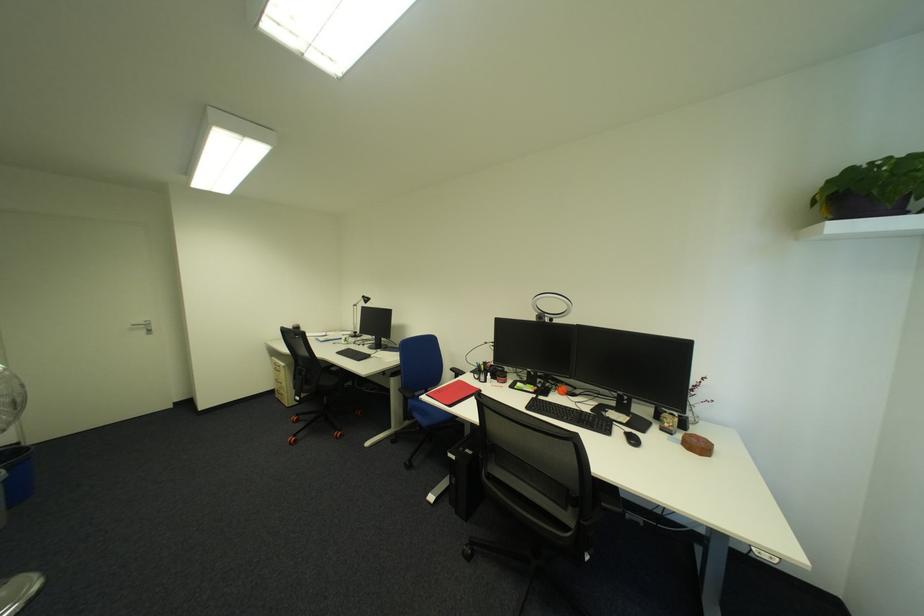
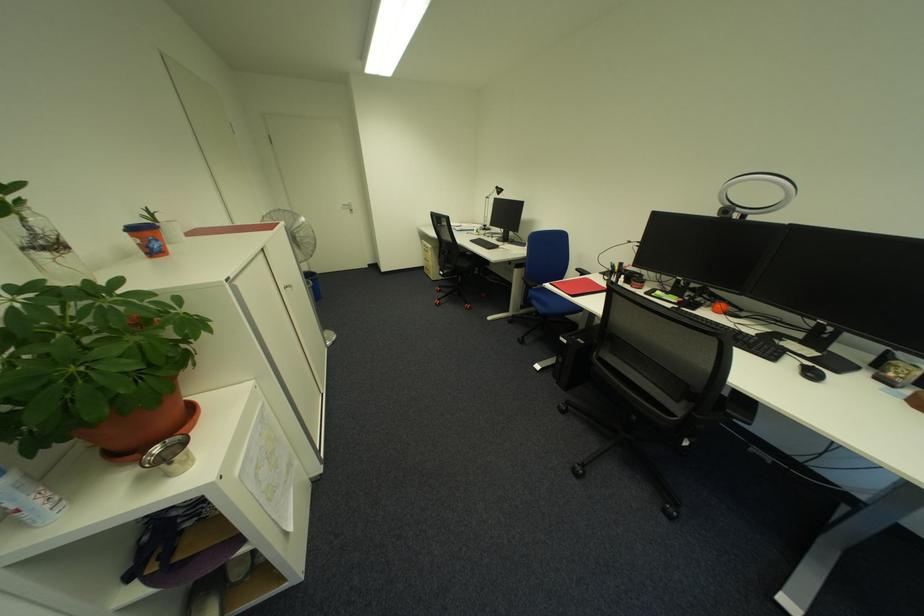
Locate, in the second image, the point that corresponds to (641,443) in the first image.

(820, 376)